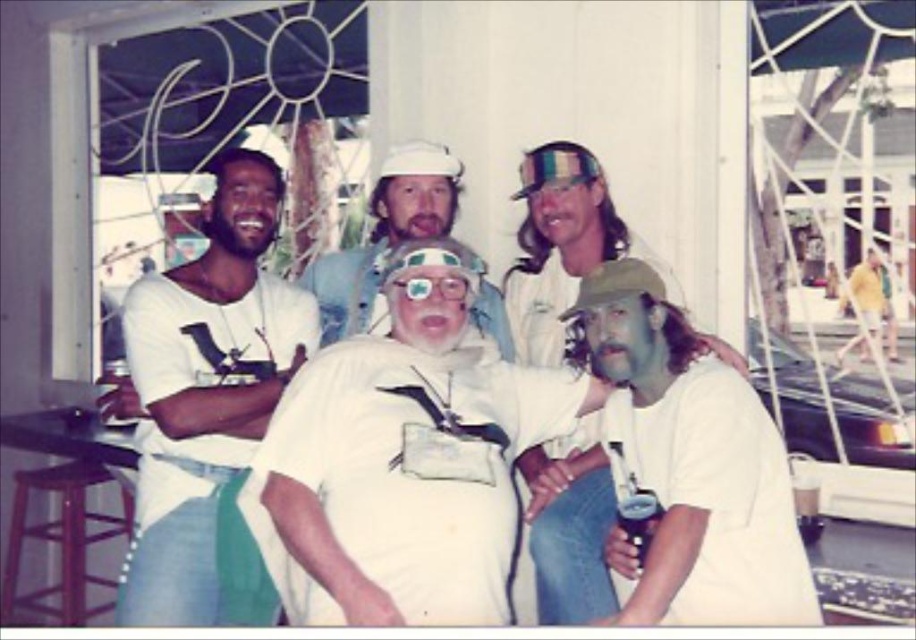
Which of these two, white cotton shirt at left or white matte hat at center, stands taller?

Standing taller between the two is white cotton shirt at left.

Looking at this image, who is lower down, white cotton shirt at left or white matte hat at center?

white cotton shirt at left is lower down.

Is point (253, 385) farther from viewer compared to point (450, 161)?

No, it is in front of (450, 161).

Locate an element on the screen. This screenshot has height=640, width=916. white cotton shirt at left is located at coordinates (209, 406).

Which is behind, point (26, 529) or point (453, 280)?

Point (26, 529)

Is wooden stool at lower left further to camera compared to clear plastic goggles at center?

Yes.

Which is behind, point (53, 588) or point (406, 284)?

The point (53, 588) is behind.

Find the location of a particular element. The image size is (916, 640). wooden stool at lower left is located at coordinates (62, 540).

Between white cotton shirt at left and clear plastic goggles at center, which one appears on the right side from the viewer's perspective?

clear plastic goggles at center is more to the right.

Can you confirm if white cotton shirt at left is bigger than clear plastic goggles at center?

Correct, white cotton shirt at left is larger in size than clear plastic goggles at center.

Does point (206, 400) lie in front of point (424, 291)?

No.

Where is `white cotton shirt at left`? This screenshot has height=640, width=916. white cotton shirt at left is located at coordinates (209, 406).